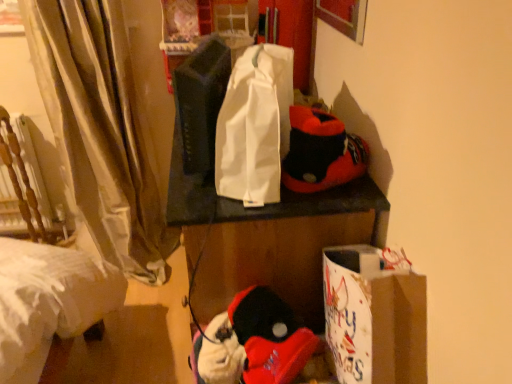
Question: Can you confirm if white fabric tote bag at center is shorter than soft plush slippers at upper right, acting as the second twin starting from the left?

Choices:
 (A) yes
 (B) no

Answer: (B)

Question: Does white fabric tote bag at center have a smaller size compared to soft plush slippers at upper right, acting as the second twin starting from the left?

Choices:
 (A) no
 (B) yes

Answer: (A)

Question: Is white fabric tote bag at center positioned before soft plush slippers at upper right, the first twin when ordered from right to left?

Choices:
 (A) no
 (B) yes

Answer: (B)

Question: From a real-world perspective, is white fabric tote bag at center on top of soft plush slippers at upper right, acting as the second twin starting from the left?

Choices:
 (A) no
 (B) yes

Answer: (B)

Question: Is white fabric tote bag at center next to soft plush slippers at upper right, acting as the second twin starting from the left, and touching it?

Choices:
 (A) yes
 (B) no

Answer: (B)

Question: Is white fabric tote bag at center outside of soft plush slippers at upper right, acting as the second twin starting from the left?

Choices:
 (A) no
 (B) yes

Answer: (B)

Question: From the image's perspective, is matte black speaker at center, arranged as the 2th twin when viewed from the right, under white paper bag at lower right?

Choices:
 (A) no
 (B) yes

Answer: (A)

Question: Considering the relative sizes of matte black speaker at center, marked as the first twin in a left-to-right arrangement, and white paper bag at lower right in the image provided, is matte black speaker at center, marked as the first twin in a left-to-right arrangement, smaller than white paper bag at lower right?

Choices:
 (A) yes
 (B) no

Answer: (A)

Question: Is matte black speaker at center, marked as the first twin in a left-to-right arrangement, outside of white paper bag at lower right?

Choices:
 (A) no
 (B) yes

Answer: (B)

Question: Is matte black speaker at center, arranged as the 2th twin when viewed from the right, facing away from white paper bag at lower right?

Choices:
 (A) yes
 (B) no

Answer: (B)

Question: Is matte black speaker at center, marked as the first twin in a left-to-right arrangement, thinner than white paper bag at lower right?

Choices:
 (A) no
 (B) yes

Answer: (B)

Question: Would you say white paper bag at lower right is part of matte black speaker at center, arranged as the 2th twin when viewed from the right,'s contents?

Choices:
 (A) no
 (B) yes

Answer: (A)

Question: Is fluffy white plush at lower center, placed as the 2th toy when sorted from right to left, taller than matte black speaker at center, arranged as the 2th twin when viewed from the right?

Choices:
 (A) yes
 (B) no

Answer: (B)